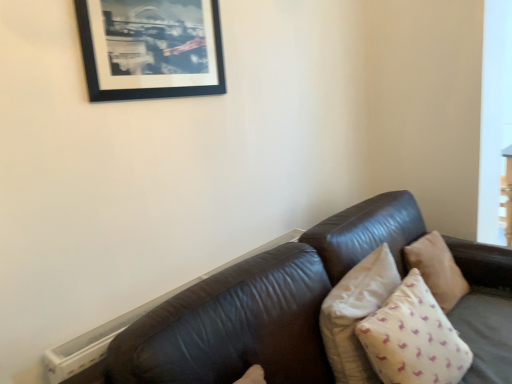
Question: Can you confirm if beige cotton pillow at lower right, which is the third pillow from back to front, is taller than beige fabric pillow at right, which is the 3th pillow in front-to-back order?

Choices:
 (A) yes
 (B) no

Answer: (A)

Question: Is beige cotton pillow at lower right, the first pillow viewed from the front, to the right of beige fabric pillow at right, which is the 3th pillow in front-to-back order, from the viewer's perspective?

Choices:
 (A) no
 (B) yes

Answer: (A)

Question: From the image's perspective, is beige cotton pillow at lower right, which is the third pillow from back to front, below beige fabric pillow at right, which is counted as the 1th pillow, starting from the back?

Choices:
 (A) no
 (B) yes

Answer: (B)

Question: Is beige cotton pillow at lower right, which is the third pillow from back to front, beside beige fabric pillow at right, which is the 3th pillow in front-to-back order?

Choices:
 (A) yes
 (B) no

Answer: (B)

Question: Is beige cotton pillow at lower right, which is the third pillow from back to front, aimed at beige fabric pillow at right, which is the 3th pillow in front-to-back order?

Choices:
 (A) no
 (B) yes

Answer: (A)

Question: Is beige cotton pillow at lower right, which is the third pillow from back to front, wider or thinner than black matte picture frame at upper left?

Choices:
 (A) thin
 (B) wide

Answer: (B)

Question: Is point (389, 347) positioned closer to the camera than point (143, 57)?

Choices:
 (A) closer
 (B) farther

Answer: (A)

Question: From the image's perspective, is beige cotton pillow at lower right, which is the third pillow from back to front, located above or below black matte picture frame at upper left?

Choices:
 (A) above
 (B) below

Answer: (B)

Question: Considering the positions of beige cotton pillow at lower right, the first pillow viewed from the front, and black matte picture frame at upper left in the image, is beige cotton pillow at lower right, the first pillow viewed from the front, taller or shorter than black matte picture frame at upper left?

Choices:
 (A) short
 (B) tall

Answer: (B)

Question: Do you think beige fabric pillow at right, arranged as the 2th pillow when viewed from the back, is within black matte picture frame at upper left, or outside of it?

Choices:
 (A) inside
 (B) outside

Answer: (B)

Question: Is beige fabric pillow at right, arranged as the 2th pillow when viewed from the back, to the left or to the right of black matte picture frame at upper left in the image?

Choices:
 (A) right
 (B) left

Answer: (A)

Question: Is beige fabric pillow at right, arranged as the 2th pillow when viewed from the back, in front of or behind black matte picture frame at upper left in the image?

Choices:
 (A) front
 (B) behind

Answer: (B)

Question: In terms of height, does beige fabric pillow at right, arranged as the 2th pillow when viewed from the back, look taller or shorter compared to black matte picture frame at upper left?

Choices:
 (A) short
 (B) tall

Answer: (B)

Question: Is beige cotton pillow at lower right, which is the third pillow from back to front, to the left or to the right of beige fabric pillow at right, which is counted as the 1th pillow, starting from the back, in the image?

Choices:
 (A) right
 (B) left

Answer: (B)

Question: Do you think beige cotton pillow at lower right, the first pillow viewed from the front, is within beige fabric pillow at right, which is counted as the 1th pillow, starting from the back, or outside of it?

Choices:
 (A) inside
 (B) outside

Answer: (B)